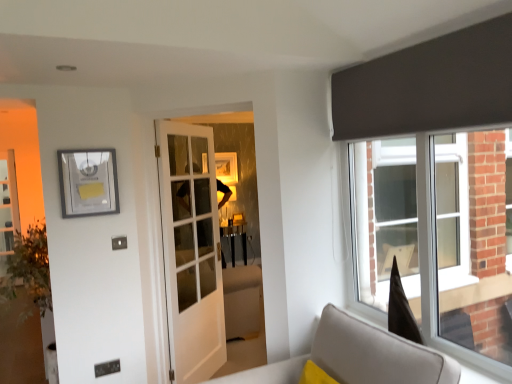
Question: Is the depth of white glass door at center greater than that of light gray fabric sofa at lower right?

Choices:
 (A) yes
 (B) no

Answer: (A)

Question: Considering the relative sizes of white glass door at center and light gray fabric sofa at lower right in the image provided, is white glass door at center bigger than light gray fabric sofa at lower right?

Choices:
 (A) no
 (B) yes

Answer: (A)

Question: Does white glass door at center appear on the right side of light gray fabric sofa at lower right?

Choices:
 (A) no
 (B) yes

Answer: (A)

Question: Considering the relative positions of white glass door at center and light gray fabric sofa at lower right in the image provided, is white glass door at center to the left of light gray fabric sofa at lower right from the viewer's perspective?

Choices:
 (A) yes
 (B) no

Answer: (A)

Question: From a real-world perspective, is white glass door at center beneath light gray fabric sofa at lower right?

Choices:
 (A) yes
 (B) no

Answer: (B)

Question: From the image's perspective, relative to matte silver picture frame at upper left, is white glass door at center above or below?

Choices:
 (A) above
 (B) below

Answer: (B)

Question: In the image, is white glass door at center on the left side or the right side of matte silver picture frame at upper left?

Choices:
 (A) right
 (B) left

Answer: (A)

Question: Considering the positions of point (164, 248) and point (76, 157), is point (164, 248) closer or farther from the camera than point (76, 157)?

Choices:
 (A) farther
 (B) closer

Answer: (A)

Question: Based on their sizes in the image, would you say white glass door at center is bigger or smaller than matte silver picture frame at upper left?

Choices:
 (A) big
 (B) small

Answer: (A)

Question: From the image's perspective, is light gray fabric sofa at lower right located above or below matte silver picture frame at upper left?

Choices:
 (A) below
 (B) above

Answer: (A)

Question: In terms of size, does light gray fabric sofa at lower right appear bigger or smaller than matte silver picture frame at upper left?

Choices:
 (A) big
 (B) small

Answer: (A)

Question: From a real-world perspective, is light gray fabric sofa at lower right above or below matte silver picture frame at upper left?

Choices:
 (A) above
 (B) below

Answer: (B)

Question: Is light gray fabric sofa at lower right spatially inside matte silver picture frame at upper left, or outside of it?

Choices:
 (A) outside
 (B) inside

Answer: (A)

Question: Does point (69, 216) appear closer or farther from the camera than point (211, 140)?

Choices:
 (A) farther
 (B) closer

Answer: (B)

Question: Considering their positions, is matte silver picture frame at upper left located in front of or behind white glass door at center?

Choices:
 (A) front
 (B) behind

Answer: (A)